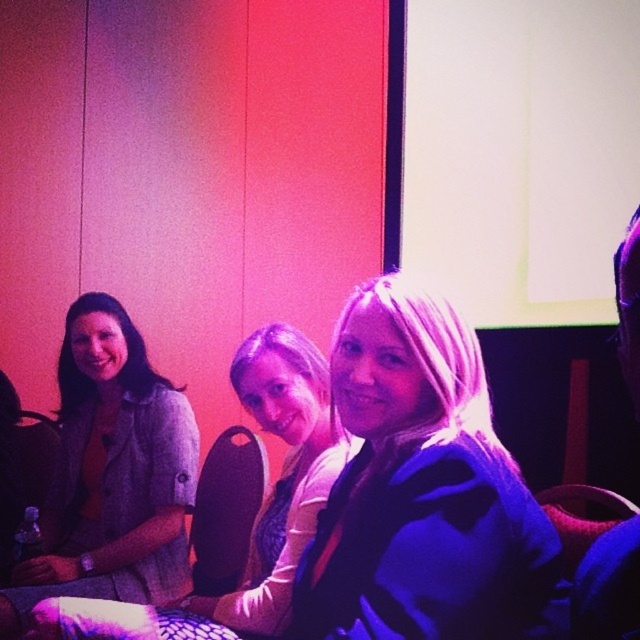
Question: Which of the following is the closest to the observer?

Choices:
 (A) matte gray blazer at left
 (B) matte gray blazer at center

Answer: (B)

Question: In this image, where is satin blue dress at center located relative to matte gray blazer at left?

Choices:
 (A) above
 (B) below

Answer: (A)

Question: Is matte gray blazer at left to the right of matte gray blazer at center from the viewer's perspective?

Choices:
 (A) yes
 (B) no

Answer: (B)

Question: Is matte gray blazer at left further to the viewer compared to matte gray blazer at center?

Choices:
 (A) no
 (B) yes

Answer: (B)

Question: Which point appears farthest from the camera in this image?

Choices:
 (A) (160, 586)
 (B) (288, 376)
 (C) (376, 573)

Answer: (A)

Question: Considering the real-world distances, which object is farthest from the matte gray blazer at center?

Choices:
 (A) matte gray blazer at left
 (B) satin blue dress at center

Answer: (A)